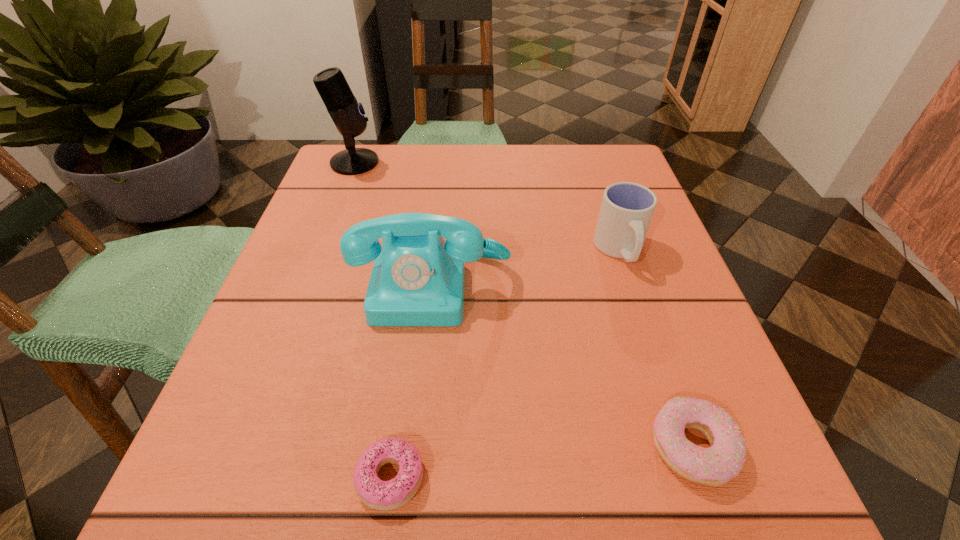
You are a GUI agent. You are given a task and a screenshot of the screen. Output one action in this format:
    pyautogui.click(x=<x>, y=<y>)
    Task: Click on the free space between the left doughnut and the right doughnut
    This screenshot has height=540, width=960.
    Given the screenshot: What is the action you would take?
    pyautogui.click(x=541, y=462)

You are a GUI agent. You are given a task and a screenshot of the screen. Output one action in this format:
    pyautogui.click(x=<x>, y=<y>)
    Task: Click on the vacant space in between the second tallest object and the shorter doughnut
    The height and width of the screenshot is (540, 960).
    Given the screenshot: What is the action you would take?
    pyautogui.click(x=412, y=381)

You are a GUI agent. You are given a task and a screenshot of the screen. Output one action in this format:
    pyautogui.click(x=<x>, y=<y>)
    Task: Click on the free space between the left doughnut and the telephone
    The image size is (960, 540).
    Given the screenshot: What is the action you would take?
    pyautogui.click(x=412, y=381)

Find the location of a particular element. object that stands as the second closest to the shorter doughnut is located at coordinates (717, 465).

Locate which object ranks in proximity to the leftmost object. Please provide its 2D coordinates. Your answer should be formatted as a tuple, i.e. [(x, y)], where the tuple contains the x and y coordinates of a point satisfying the conditions above.

[(417, 279)]

You are a GUI agent. You are given a task and a screenshot of the screen. Output one action in this format:
    pyautogui.click(x=<x>, y=<y>)
    Task: Click on the free location that satisfies the following two spatial constraints: 1. on the dial of the taller doughnut; 2. on the left side of the telephone
    The image size is (960, 540).
    Given the screenshot: What is the action you would take?
    pyautogui.click(x=416, y=447)

You are a GUI agent. You are given a task and a screenshot of the screen. Output one action in this format:
    pyautogui.click(x=<x>, y=<y>)
    Task: Click on the vacant space that satisfies the following two spatial constraints: 1. on the back side of the taller doughnut; 2. on the stand of the leftmost object
    Image resolution: width=960 pixels, height=540 pixels.
    Given the screenshot: What is the action you would take?
    pyautogui.click(x=594, y=163)